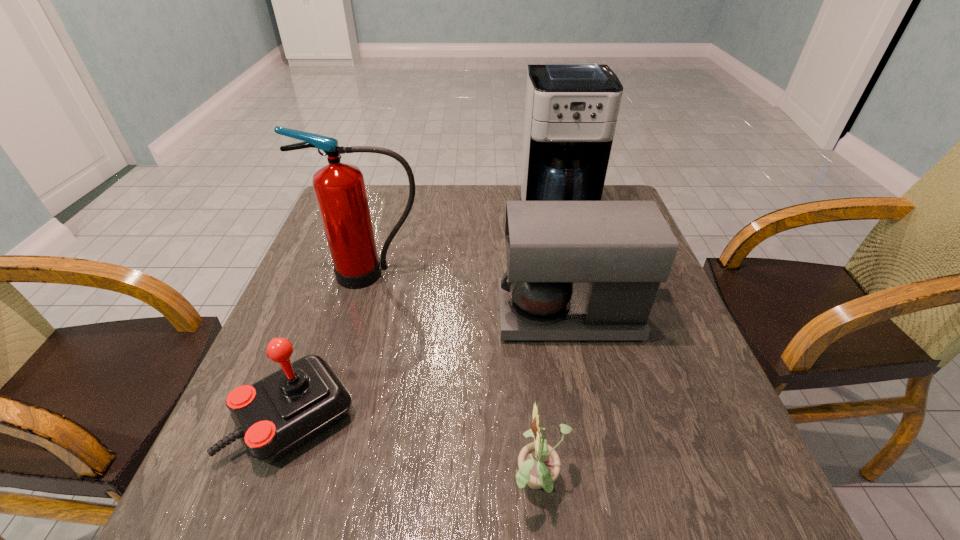
This screenshot has width=960, height=540. I want to click on vacant region located 0.150m on the carafe side of the shorter coffee maker, so click(x=434, y=315).

At what (x,y) coordinates should I click in order to perform the action: click on free region located on the carafe side of the shorter coffee maker. Please return your answer as a coordinate pair (x, y). Looking at the image, I should click on (416, 315).

Locate an element on the screen. This screenshot has height=540, width=960. free space located 0.370m on the back of the joystick is located at coordinates (351, 257).

Image resolution: width=960 pixels, height=540 pixels. In order to click on vacant area situated on the front-facing side of the sunflower in this screenshot , I will do `click(340, 483)`.

I want to click on vacant space located on the front-facing side of the sunflower, so click(425, 483).

Find the location of `vacant space situated 0.250m on the front-facing side of the sunflower`. vacant space situated 0.250m on the front-facing side of the sunflower is located at coordinates (358, 483).

Find the location of a particular element. Image resolution: width=960 pixels, height=540 pixels. object that is at the far edge is located at coordinates (571, 108).

This screenshot has height=540, width=960. In order to click on joystick that is at the near edge in this screenshot , I will do `click(274, 416)`.

Where is `sunflower that is positioned at the near edge`? The width and height of the screenshot is (960, 540). sunflower that is positioned at the near edge is located at coordinates (539, 465).

At what (x,y) coordinates should I click in order to perform the action: click on fire extinguisher positioned at the left edge. Please return your answer as a coordinate pair (x, y). The width and height of the screenshot is (960, 540). Looking at the image, I should click on (340, 191).